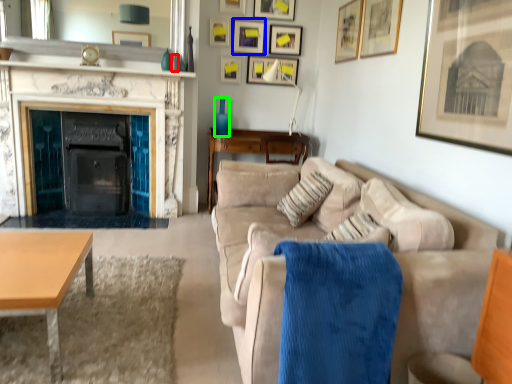
Question: Based on their relative distances, which object is farther from vase (highlighted by a red box)? Choose from picture frame (highlighted by a blue box) and vase (highlighted by a green box).

Choices:
 (A) picture frame
 (B) vase

Answer: (A)